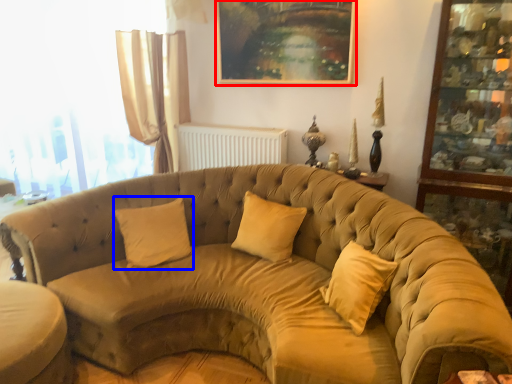
Question: Among these objects, which one is nearest to the camera, picture frame (highlighted by a red box) or pillow (highlighted by a blue box)?

Choices:
 (A) picture frame
 (B) pillow

Answer: (B)